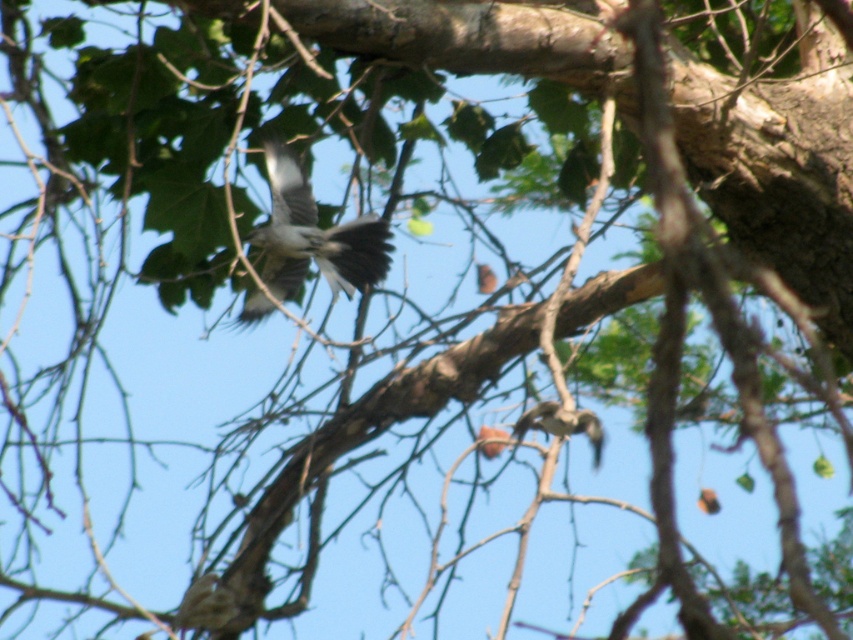
Question: Which point appears closest to the camera in this image?

Choices:
 (A) (558, 432)
 (B) (360, 280)

Answer: (A)

Question: Is gray feathered bird at center closer to the viewer compared to brown speckled feather at lower right?

Choices:
 (A) yes
 (B) no

Answer: (B)

Question: Which point is farther from the camera taking this photo?

Choices:
 (A) (595, 442)
 (B) (265, 141)

Answer: (B)

Question: Does gray feathered bird at center have a greater width compared to brown speckled feather at lower right?

Choices:
 (A) yes
 (B) no

Answer: (A)

Question: Which of the following is the closest to the observer?

Choices:
 (A) gray feathered bird at center
 (B) brown speckled feather at lower right

Answer: (B)

Question: Does gray feathered bird at center have a smaller size compared to brown speckled feather at lower right?

Choices:
 (A) yes
 (B) no

Answer: (B)